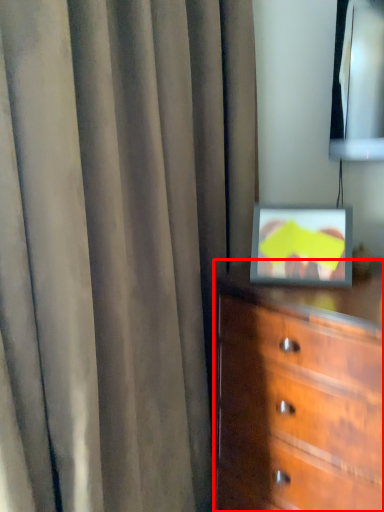
Question: From the image's perspective, where is chest of drawers (annotated by the red box) located relative to curtain?

Choices:
 (A) below
 (B) above

Answer: (A)